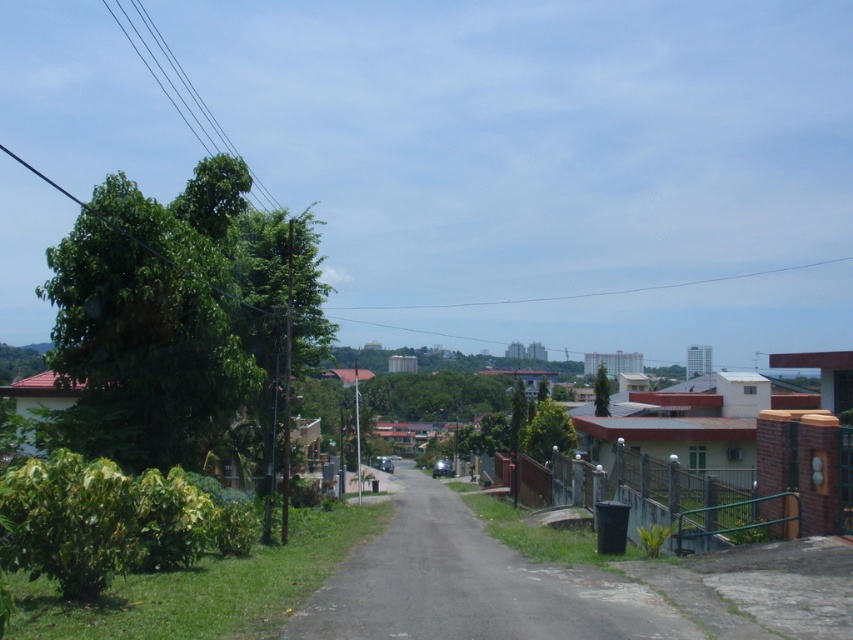
Can you confirm if green leafy tree at left is taller than green matte tree at center?

Correct, green leafy tree at left is much taller as green matte tree at center.

Does green leafy tree at left appear on the left side of green matte tree at center?

Correct, you'll find green leafy tree at left to the left of green matte tree at center.

What are the coordinates of `green leafy tree at left` in the screenshot? It's located at (166, 316).

Who is taller, green leafy tree at left or gray asphalt road at center?

green leafy tree at left is taller.

How distant is green leafy tree at left from gray asphalt road at center?

They are 7.56 meters apart.

The image size is (853, 640). Find the location of `green leafy tree at left`. green leafy tree at left is located at coordinates (166, 316).

Identify the location of green leafy tree at left. This screenshot has height=640, width=853. (166, 316).

Does gray asphalt road at center have a smaller size compared to green matte tree at center?

Yes.

Locate an element on the screen. gray asphalt road at center is located at coordinates (471, 586).

In order to click on gray asphalt road at center in this screenshot , I will do `click(471, 586)`.